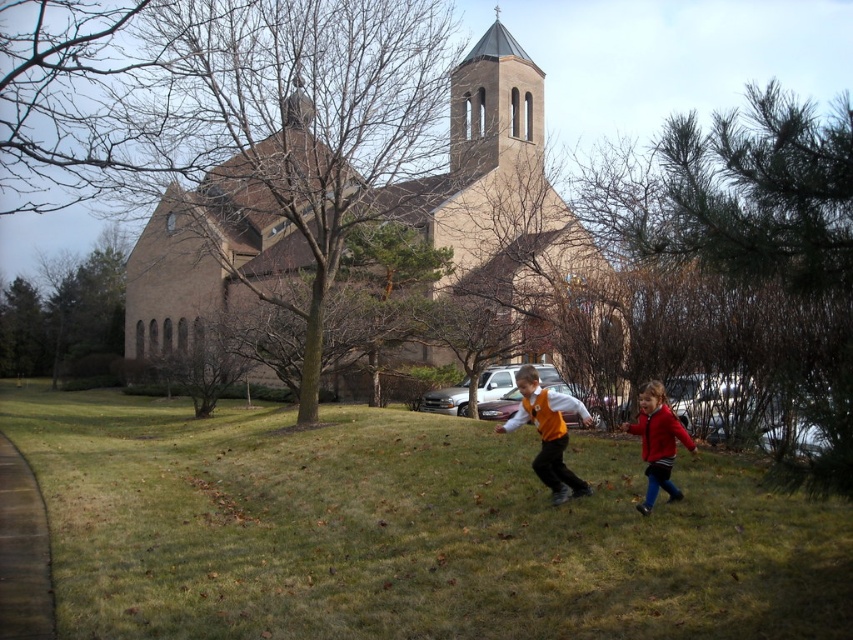
Between point (561, 410) and point (654, 444), which one is positioned in front?

Point (654, 444)

Can you confirm if orange matte vest at center is positioned to the right of red fleece jacket at lower right?

In fact, orange matte vest at center is to the left of red fleece jacket at lower right.

Identify the location of orange matte vest at center. (548, 433).

Who is more forward, (585, 588) or (492, 90)?

Point (585, 588) is more forward.

Measure the distance from green grass at center to beige stone church at center.

They are 17.80 meters apart.

Find the location of `green grass at center`. green grass at center is located at coordinates (405, 531).

Which is behind, point (434, 460) or point (648, 460)?

Positioned behind is point (434, 460).

The image size is (853, 640). What do you see at coordinates (405, 531) in the screenshot? I see `green grass at center` at bounding box center [405, 531].

Does point (677, 513) come in front of point (654, 465)?

Yes, it is.

Locate an element on the screen. This screenshot has width=853, height=640. green grass at center is located at coordinates (405, 531).